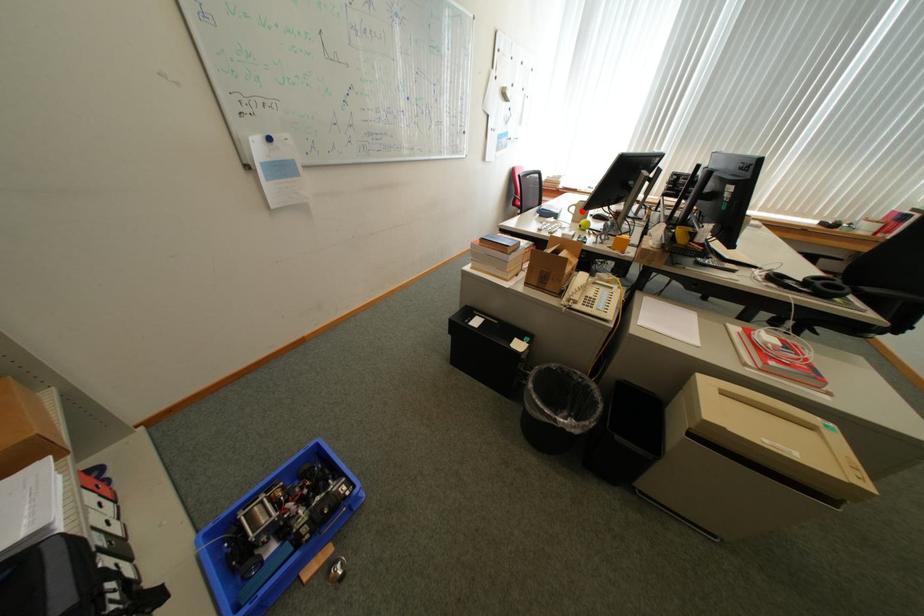
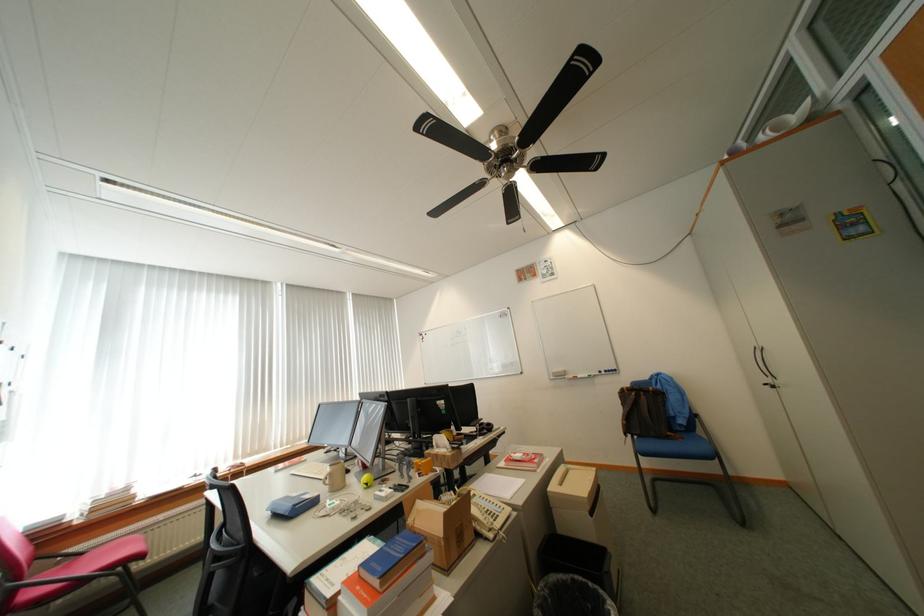
Where in the second image is the point corresponding to the highlighted location from the first image?

(336, 482)